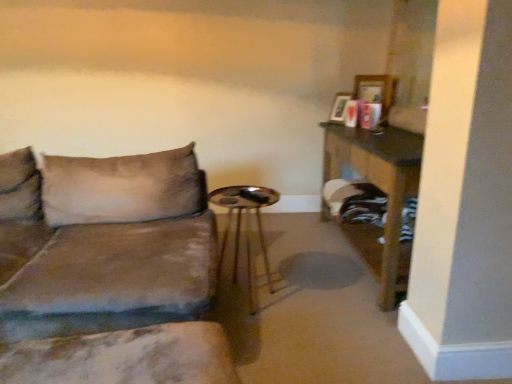
Locate an element on the screen. The height and width of the screenshot is (384, 512). vacant area that lies in front of metallic gold side table at center is located at coordinates (278, 340).